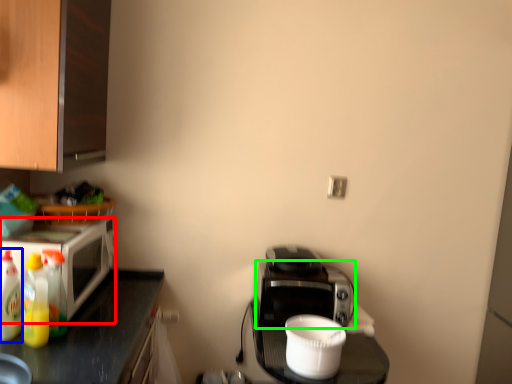
Question: Which is farther away from microwave oven (highlighted by a red box)? bottle (highlighted by a blue box) or appliance (highlighted by a green box)?

Choices:
 (A) bottle
 (B) appliance

Answer: (B)